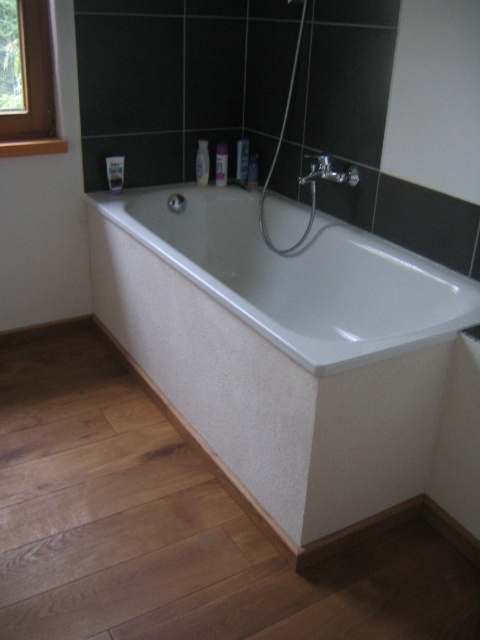
You are standing in the bathroom and want to place a new picture frame exactly where the wooden frame at upper left is currently located. What are the coordinates of the spot where you should place the new frame?

The wooden frame at upper left is located at coordinates (33, 88), so you should place the new frame at those coordinates.

You are standing in the bathroom and want to reach both the wooden frame at upper left and the matte silver faucet at upper center. Which object is closer to the left wall?

The wooden frame at upper left is closer to the left wall because it is positioned to the left of the matte silver faucet at upper center.